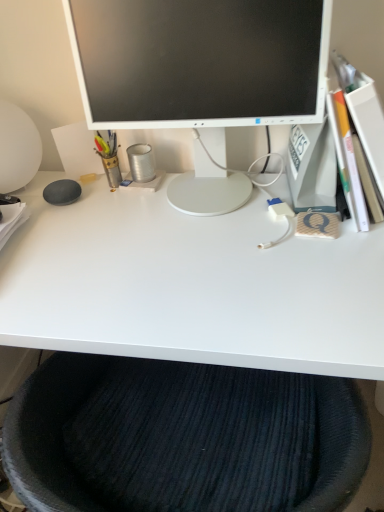
Locate an element on the screen. Image resolution: width=384 pixels, height=512 pixels. free point below white glossy monitor at center (from a real-world perspective) is located at coordinates (203, 192).